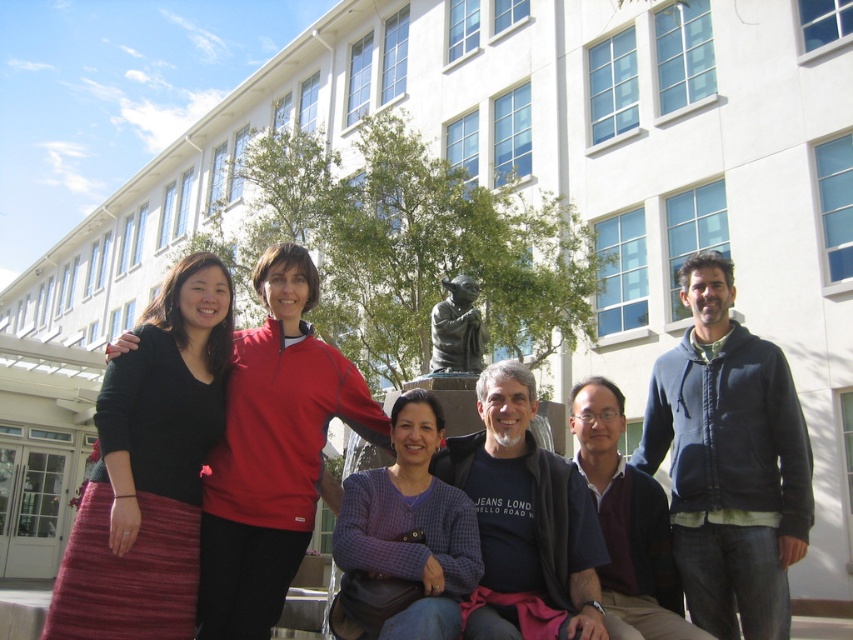
You are standing in front of the building and see two people wearing the matte red jacket at center and the purple checkered sweater at center. If you want to take a photo that includes both of them, which direction should you move to ensure both are in frame?

You should move to the right so that both the matte red jacket at center and the purple checkered sweater at center are visible in the frame, as the matte red jacket at center is to the left of the purple checkered sweater at center.

Based on the photo, you are a photographer trying to capture a clear shot of the black knit skirt at left without the bronze statue at center blocking it. How should you adjust your camera angle?

The black knit skirt at left is positioned under the bronze statue at center, so you can lower your camera angle to avoid the statue blocking the view of the skirt.